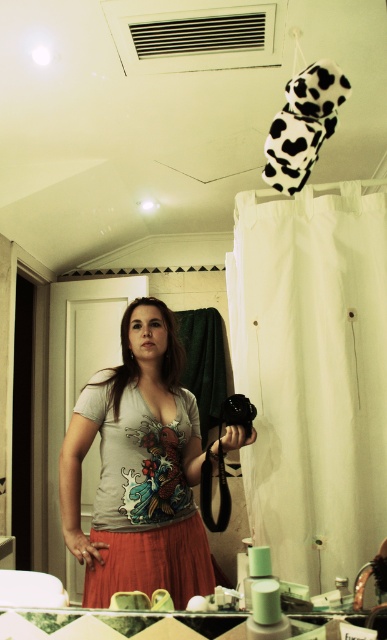
You are a photographer trying to capture the matte cotton dress at center and the black plastic camera at lower center in a single shot. Which object should you focus on first to ensure both are in focus?

The matte cotton dress at center is closer to the viewer than the black plastic camera at lower center, so you should focus on the matte cotton dress at center first to ensure both are in focus.

In the scene shown: You are taking a selfie in the bathroom and want to focus on two points in the scene. The first point is at coordinates point (133, 480) and the second point is at point (224, 422). Which point is closer to the camera?

Point (133, 480) is closer to the camera than point (224, 422).

You are trying to find the matte cotton dress at center in the bathroom. According to the scene description, where exactly is it positioned?

The matte cotton dress at center is located at point (143, 499).